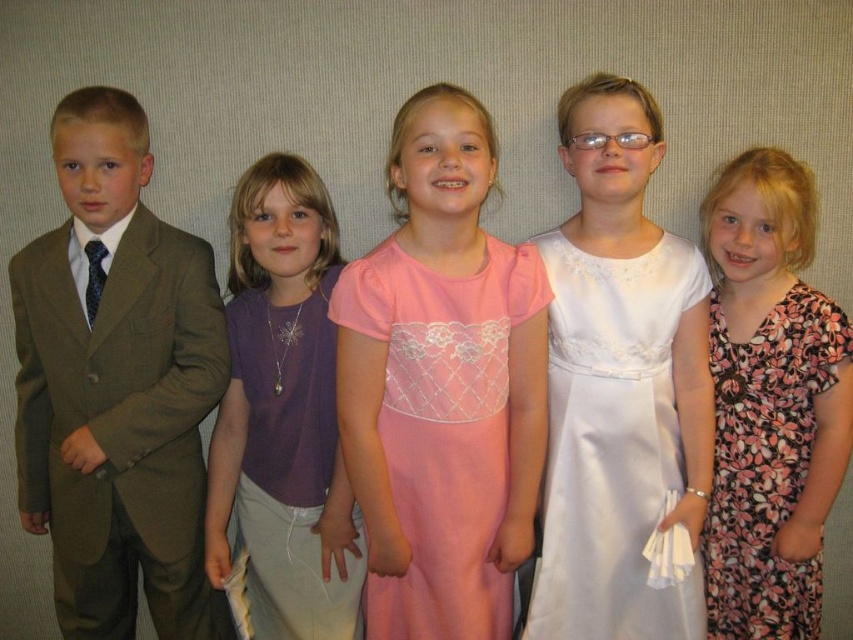
You are organizing a clothing donation drive and need to determine which item is larger between the purple fabric shirt at center and the floral print dress at right. Based on the image, which one is bigger?

The purple fabric shirt at center is bigger than the floral print dress at right according to the description.

You are a photographer setting up for a group photo. You notice the pink satin dress at center and the floral print dress at right. Which dress should you position closer to the camera to ensure both are equally visible?

The pink satin dress at center is larger in size than the floral print dress at right, so you should position the floral print dress at right closer to the camera to balance their visibility.